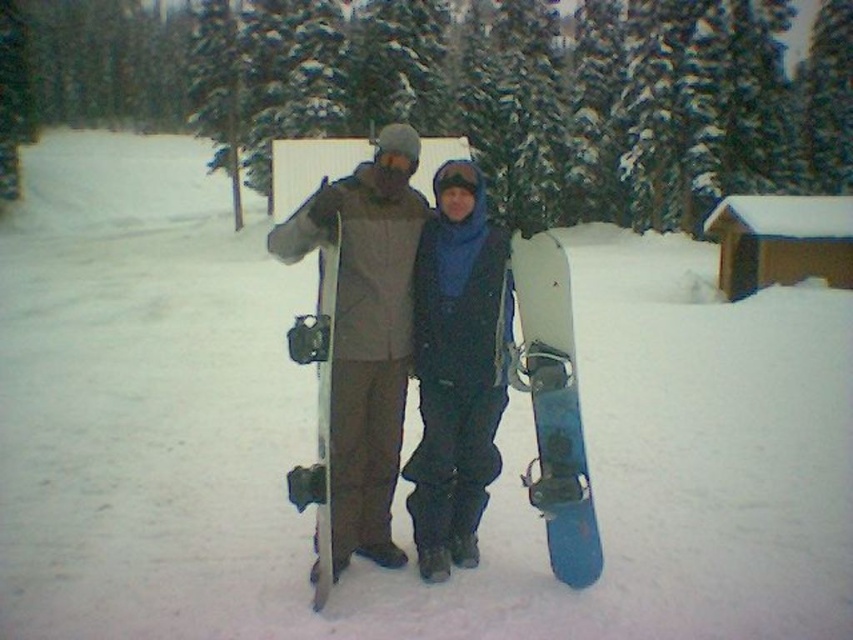
Question: Can you confirm if matte blue snowboard at center is positioned below blue matte snowboard at center?

Choices:
 (A) yes
 (B) no

Answer: (B)

Question: Which object appears farthest from the camera in this image?

Choices:
 (A) matte blue snowboard at center
 (B) blue matte snowboard at center
 (C) matte gray snowboard at center
 (D) matte black snowboard at center

Answer: (A)

Question: Among these points, which one is nearest to the camera?

Choices:
 (A) (323, 483)
 (B) (469, 412)

Answer: (A)

Question: Can you confirm if matte black snowboard at center is positioned to the left of matte blue snowboard at center?

Choices:
 (A) no
 (B) yes

Answer: (A)

Question: From the image, what is the correct spatial relationship of matte blue snowboard at center in relation to white matte snowboard at center?

Choices:
 (A) left
 (B) right

Answer: (B)

Question: Based on their relative distances, which object is farther from the matte blue snowboard at center?

Choices:
 (A) blue matte snowboard at center
 (B) matte gray snowboard at center

Answer: (B)